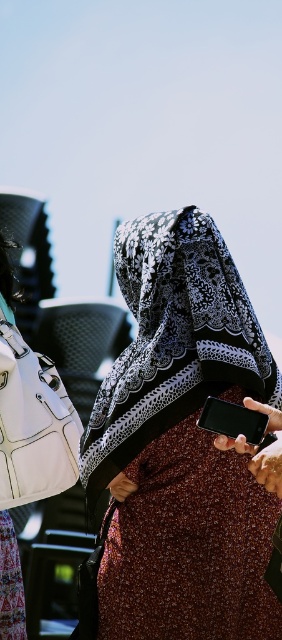
You are standing in the scene and want to move from the point at coordinates point (166, 545) to the point at coordinates point (216, 432). Which direction should you move to get closer to the second point?

To move from point (166, 545) to point (216, 432), you should move backward since point (166, 545) is closer to the viewer than point (216, 432).

You are a fashion designer observing the two central items in the image. Which item has a greater width between the patterned fabric headscarf at center and the brown textured dress at center?

The patterned fabric headscarf at center has a greater width than the brown textured dress at center.